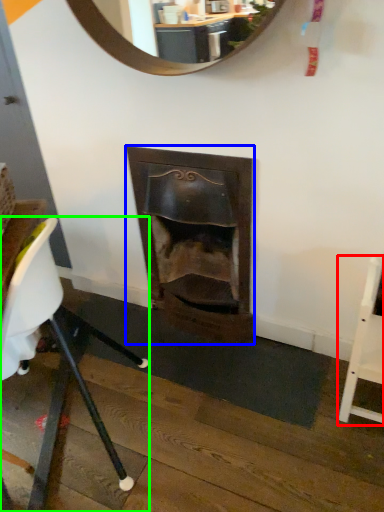
Question: Considering the real-world distances, which object is farthest from chair (highlighted by a red box)? fireplace (highlighted by a blue box) or chair (highlighted by a green box)?

Choices:
 (A) fireplace
 (B) chair

Answer: (B)